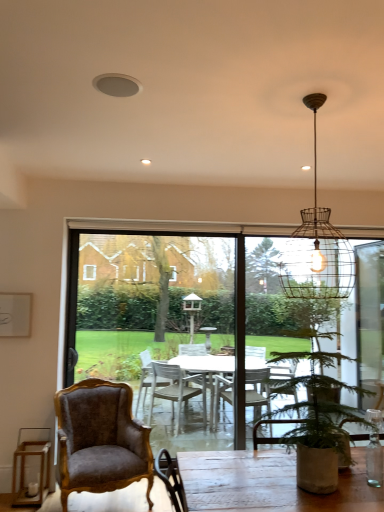
Where is `transparent glass table at center`? transparent glass table at center is located at coordinates (148, 298).

Would you say transparent glass table at center is part of green leafy plant in pot at lower right's contents?

No, transparent glass table at center is not inside green leafy plant in pot at lower right.

Which object is further away from the camera taking this photo, green leafy plant in pot at lower right or transparent glass table at center?

transparent glass table at center is further from the camera.

Based on the photo, from a real-world perspective, is green leafy plant in pot at lower right physically below transparent glass table at center?

Yes.

Identify the location of chair behind the green leafy plant in pot at lower right. (100, 440).

From a real-world perspective, who is located lower, green leafy plant in pot at lower right or velvet brown armchair at lower left?

velvet brown armchair at lower left.

Considering the relative sizes of green leafy plant in pot at lower right and velvet brown armchair at lower left in the image provided, is green leafy plant in pot at lower right smaller than velvet brown armchair at lower left?

Indeed, green leafy plant in pot at lower right has a smaller size compared to velvet brown armchair at lower left.

Is velvet brown armchair at lower left surrounded by wire mesh pendant light at upper center?

Actually, velvet brown armchair at lower left is outside wire mesh pendant light at upper center.

Consider the image. Is wire mesh pendant light at upper center to the left or to the right of velvet brown armchair at lower left in the image?

Clearly, wire mesh pendant light at upper center is on the right of velvet brown armchair at lower left in the image.

Can you confirm if wire mesh pendant light at upper center is shorter than velvet brown armchair at lower left?

No, wire mesh pendant light at upper center is not shorter than velvet brown armchair at lower left.

Find the location of a particular element. Image resolution: width=384 pixels, height=512 pixels. light fixture that is above the velvet brown armchair at lower left (from the image's perspective) is located at coordinates point(317,247).

Which is more to the right, transparent glass table at center or velvet brown armchair at lower left?

From the viewer's perspective, transparent glass table at center appears more on the right side.

Can you confirm if transparent glass table at center is shorter than velvet brown armchair at lower left?

No.

Is transparent glass table at center further to camera compared to velvet brown armchair at lower left?

Yes.

Based on the photo, is there a large distance between transparent glass table at center and velvet brown armchair at lower left?

Yes, transparent glass table at center and velvet brown armchair at lower left are quite far apart.

Would you say transparent glass table at center is outside wire mesh pendant light at upper center?

Yes, transparent glass table at center is outside of wire mesh pendant light at upper center.

Who is shorter, transparent glass table at center or wire mesh pendant light at upper center?

wire mesh pendant light at upper center.

Is transparent glass table at center aimed at wire mesh pendant light at upper center?

Yes, transparent glass table at center is turned towards wire mesh pendant light at upper center.

Considering the positions of objects transparent glass table at center and wire mesh pendant light at upper center in the image provided, who is more to the left, transparent glass table at center or wire mesh pendant light at upper center?

From the viewer's perspective, transparent glass table at center appears more on the left side.

Is wire mesh pendant light at upper center at the right side of green leafy plant in pot at lower right?

Indeed, wire mesh pendant light at upper center is positioned on the right side of green leafy plant in pot at lower right.

From the image's perspective, which is below, wire mesh pendant light at upper center or green leafy plant in pot at lower right?

green leafy plant in pot at lower right is shown below in the image.

Does wire mesh pendant light at upper center lie behind green leafy plant in pot at lower right?

Yes, wire mesh pendant light at upper center is further from the viewer.

Considering the points (317, 298) and (339, 411), which point is in front, point (317, 298) or point (339, 411)?

Positioned in front is point (339, 411).

Based on the photo, could transparent glass table at center be considered to be inside velvet brown armchair at lower left?

That's incorrect, transparent glass table at center is not inside velvet brown armchair at lower left.

From a real-world perspective, is velvet brown armchair at lower left physically above transparent glass table at center?

No, from a real-world perspective, velvet brown armchair at lower left is not on top of transparent glass table at center.

Are velvet brown armchair at lower left and transparent glass table at center far apart?

Yes, velvet brown armchair at lower left is far from transparent glass table at center.

Is velvet brown armchair at lower left wider than transparent glass table at center?

Yes, velvet brown armchair at lower left is wider than transparent glass table at center.

Where is `window screen to the left of green leafy plant in pot at lower right`? Image resolution: width=384 pixels, height=512 pixels. window screen to the left of green leafy plant in pot at lower right is located at coordinates (148, 298).

Identify the location of chair behind the green leafy plant in pot at lower right. The height and width of the screenshot is (512, 384). (100, 440).

Estimate the real-world distances between objects in this image. Which object is further from transparent glass table at center, green leafy plant in pot at lower right or wire mesh pendant light at upper center?

The object further to transparent glass table at center is green leafy plant in pot at lower right.

Based on their spatial positions, is transparent glass table at center or green leafy plant in pot at lower right further from wire mesh pendant light at upper center?

transparent glass table at center is positioned further to the anchor wire mesh pendant light at upper center.

Based on their spatial positions, is green leafy plant in pot at lower right or velvet brown armchair at lower left further from transparent glass table at center?

green leafy plant in pot at lower right is further to transparent glass table at center.

From the image, which object appears to be farther from velvet brown armchair at lower left, green leafy plant in pot at lower right or wire mesh pendant light at upper center?

wire mesh pendant light at upper center lies further to velvet brown armchair at lower left than the other object.

Based on their spatial positions, is velvet brown armchair at lower left or wire mesh pendant light at upper center closer to transparent glass table at center?

Based on the image, velvet brown armchair at lower left appears to be nearer to transparent glass table at center.

When comparing their distances from green leafy plant in pot at lower right, does transparent glass table at center or velvet brown armchair at lower left seem further?

transparent glass table at center is further to green leafy plant in pot at lower right.

Considering their positions, is wire mesh pendant light at upper center positioned closer to transparent glass table at center than green leafy plant in pot at lower right?

wire mesh pendant light at upper center is positioned closer to the anchor transparent glass table at center.

From the image, which object appears to be farther from velvet brown armchair at lower left, wire mesh pendant light at upper center or green leafy plant in pot at lower right?

wire mesh pendant light at upper center lies further to velvet brown armchair at lower left than the other object.

Locate an element on the screen. chair positioned between green leafy plant in pot at lower right and transparent glass table at center from near to far is located at coordinates (100, 440).

Where is `chair between wire mesh pendant light at upper center and transparent glass table at center from front to back`? Image resolution: width=384 pixels, height=512 pixels. chair between wire mesh pendant light at upper center and transparent glass table at center from front to back is located at coordinates (100, 440).

Find the location of a particular element. The height and width of the screenshot is (512, 384). houseplant that lies between wire mesh pendant light at upper center and velvet brown armchair at lower left from top to bottom is located at coordinates (317, 430).

Identify the location of light fixture between green leafy plant in pot at lower right and transparent glass table at center from front to back. (317, 247).